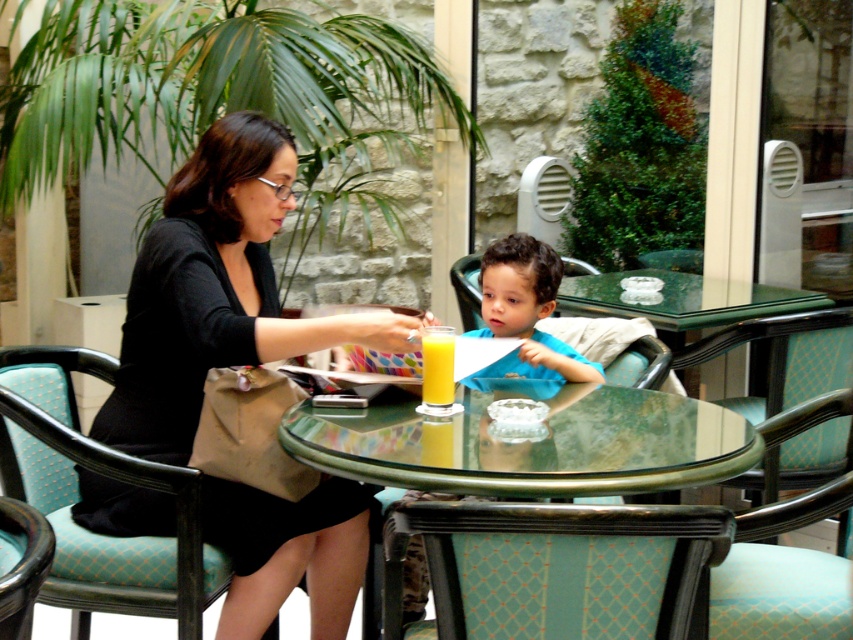
Is textured teal fabric chair at lower center wider than teal fabric chair at left?

Yes, textured teal fabric chair at lower center is wider than teal fabric chair at left.

Between textured teal fabric chair at lower center and teal fabric chair at left, which one appears on the left side from the viewer's perspective?

From the viewer's perspective, teal fabric chair at left appears more on the left side.

Locate an element on the screen. This screenshot has width=853, height=640. textured teal fabric chair at lower center is located at coordinates (560, 568).

Does teal fabric chair at left have a lesser height compared to yellow glass at center?

No, teal fabric chair at left is not shorter than yellow glass at center.

Which is more to the left, teal fabric chair at left or yellow glass at center?

teal fabric chair at left

Who is more distant from viewer, (94,560) or (444,356)?

Positioned behind is point (444,356).

At what (x,y) coordinates should I click in order to perform the action: click on teal fabric chair at left. Please return your answer as a coordinate pair (x, y). This screenshot has width=853, height=640. Looking at the image, I should click on (107, 477).

How distant is transparent glass table at center from yellow glass at center?

transparent glass table at center and yellow glass at center are 11.77 inches apart.

Which is in front, point (355, 416) or point (437, 416)?

Point (355, 416) is more forward.

Image resolution: width=853 pixels, height=640 pixels. Find the location of `transparent glass table at center`. transparent glass table at center is located at coordinates (531, 444).